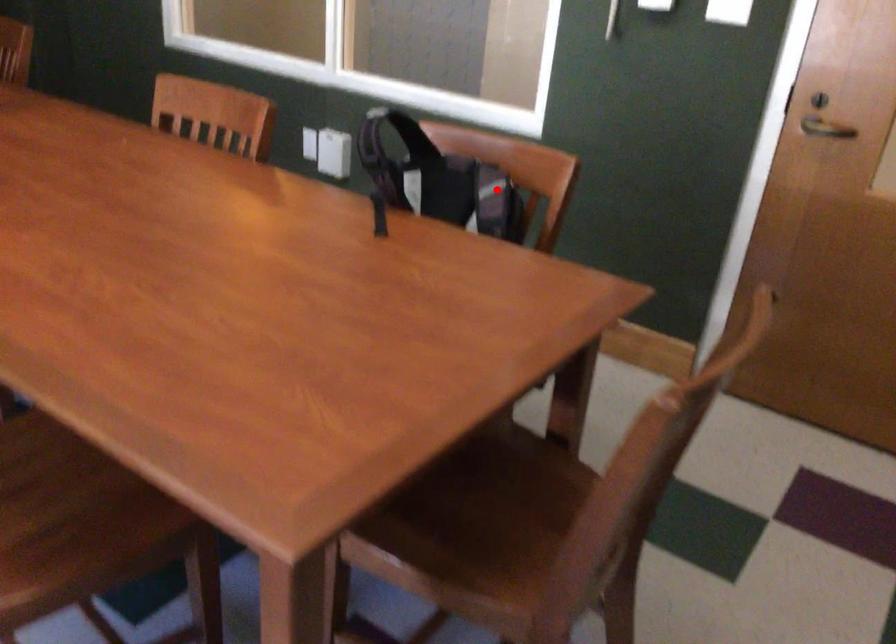
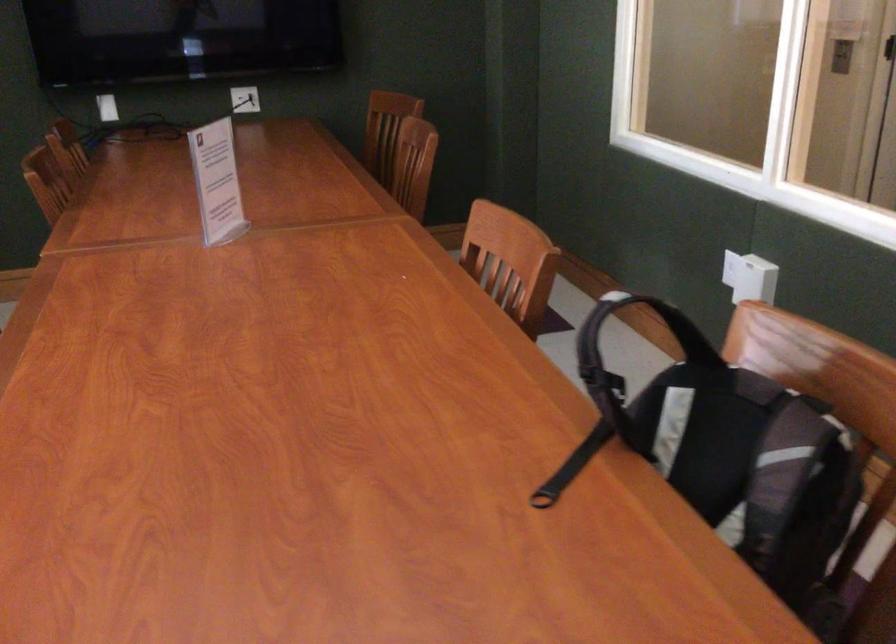
The point at the highlighted location is marked in the first image. Where is the corresponding point in the second image?

(796, 456)